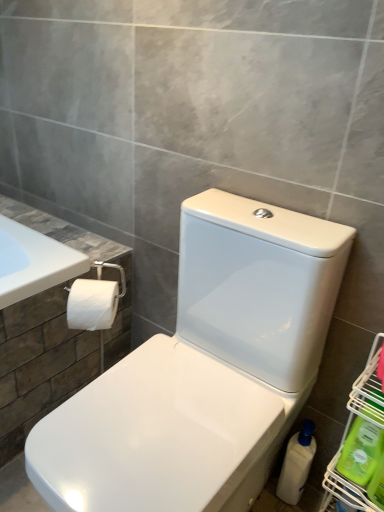
Question: Considering the relative sizes of green plastic bottle at lower right, which is counted as the first cleaning product, starting from the front, and white plastic bottle at lower right, the third cleaning product viewed from the front, in the image provided, is green plastic bottle at lower right, which is counted as the first cleaning product, starting from the front, shorter than white plastic bottle at lower right, the third cleaning product viewed from the front,?

Choices:
 (A) no
 (B) yes

Answer: (B)

Question: Considering the relative sizes of green plastic bottle at lower right, the 3th cleaning product from the back, and white plastic bottle at lower right, the third cleaning product viewed from the front, in the image provided, is green plastic bottle at lower right, the 3th cleaning product from the back, thinner than white plastic bottle at lower right, the third cleaning product viewed from the front,?

Choices:
 (A) yes
 (B) no

Answer: (A)

Question: Is white plastic bottle at lower right, the third cleaning product viewed from the front, at the back of green plastic bottle at lower right, which is counted as the first cleaning product, starting from the front?

Choices:
 (A) yes
 (B) no

Answer: (B)

Question: Is green plastic bottle at lower right, which is counted as the first cleaning product, starting from the front, oriented towards white plastic bottle at lower right, placed as the first cleaning product when sorted from back to front?

Choices:
 (A) no
 (B) yes

Answer: (A)

Question: Can you confirm if green plastic bottle at lower right, which is counted as the first cleaning product, starting from the front, is taller than white plastic bottle at lower right, placed as the first cleaning product when sorted from back to front?

Choices:
 (A) no
 (B) yes

Answer: (A)

Question: In terms of width, does white plastic bottle at lower right, placed as the first cleaning product when sorted from back to front, look wider or thinner when compared to green plastic bottle at lower right, which is counted as the first cleaning product, starting from the front?

Choices:
 (A) thin
 (B) wide

Answer: (B)

Question: Is white plastic bottle at lower right, placed as the first cleaning product when sorted from back to front, in front of or behind green plastic bottle at lower right, which is counted as the first cleaning product, starting from the front, in the image?

Choices:
 (A) front
 (B) behind

Answer: (B)

Question: From a real-world perspective, relative to green plastic bottle at lower right, which is counted as the first cleaning product, starting from the front, is white plastic bottle at lower right, the third cleaning product viewed from the front, vertically above or below?

Choices:
 (A) above
 (B) below

Answer: (B)

Question: From the image's perspective, relative to green plastic bottle at lower right, which is counted as the first cleaning product, starting from the front, is white plastic bottle at lower right, the third cleaning product viewed from the front, above or below?

Choices:
 (A) above
 (B) below

Answer: (B)

Question: Relative to white plastic bottle at lower right, placed as the first cleaning product when sorted from back to front, is green plastic bottle at lower right, the 3th cleaning product from the back, in front or behind?

Choices:
 (A) behind
 (B) front

Answer: (B)

Question: From a real-world perspective, is green plastic bottle at lower right, the 3th cleaning product from the back, positioned above or below white plastic bottle at lower right, the third cleaning product viewed from the front?

Choices:
 (A) above
 (B) below

Answer: (A)

Question: Which is correct: green plastic bottle at lower right, which is counted as the first cleaning product, starting from the front, is inside white plastic bottle at lower right, placed as the first cleaning product when sorted from back to front, or outside of it?

Choices:
 (A) outside
 (B) inside

Answer: (A)

Question: Is point (372, 488) closer or farther from the camera than point (306, 460)?

Choices:
 (A) closer
 (B) farther

Answer: (A)

Question: Considering the positions of green plastic bottle at lower right, the 3th cleaning product from the back, and white glossy toilet at center in the image, is green plastic bottle at lower right, the 3th cleaning product from the back, wider or thinner than white glossy toilet at center?

Choices:
 (A) thin
 (B) wide

Answer: (A)

Question: From the image's perspective, is green plastic bottle at lower right, which is counted as the first cleaning product, starting from the front, positioned above or below white glossy toilet at center?

Choices:
 (A) below
 (B) above

Answer: (A)